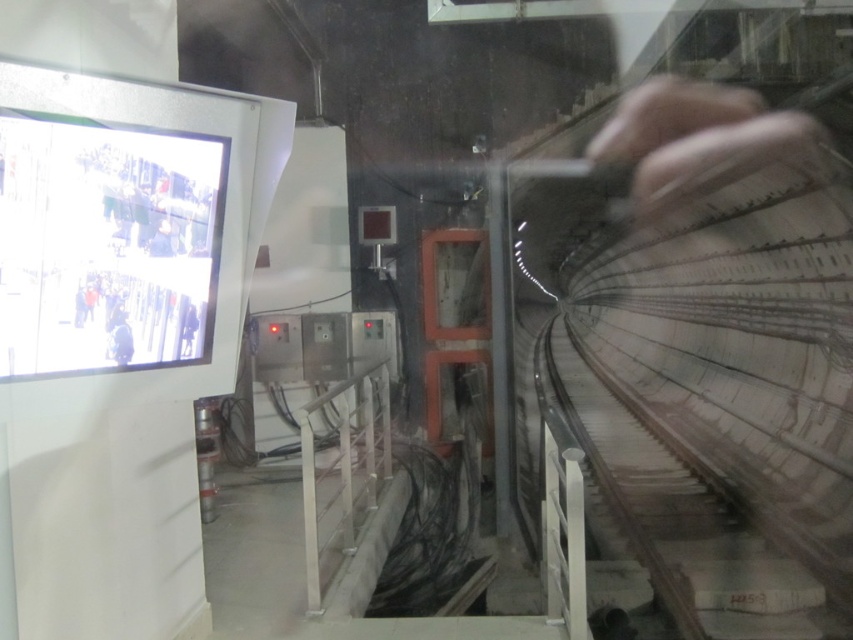
You are an inspector in the control room and need to assess the visibility of the light gray fabric jacket at left and the smooth concrete train track at right. Which object is closer to the window for better visibility?

The smooth concrete train track at right is closer to the window than the light gray fabric jacket at left, so it has better visibility.

You are standing in the control room and looking through the glass window at the tunnel tracks. There are two points marked on the window at coordinates point (650, 486) and point (119, 154). From your perspective, which point is closer to you?

Point (119, 154) is closer to you because it is in front of point 0.763, 0.763 according to their positions on the window.